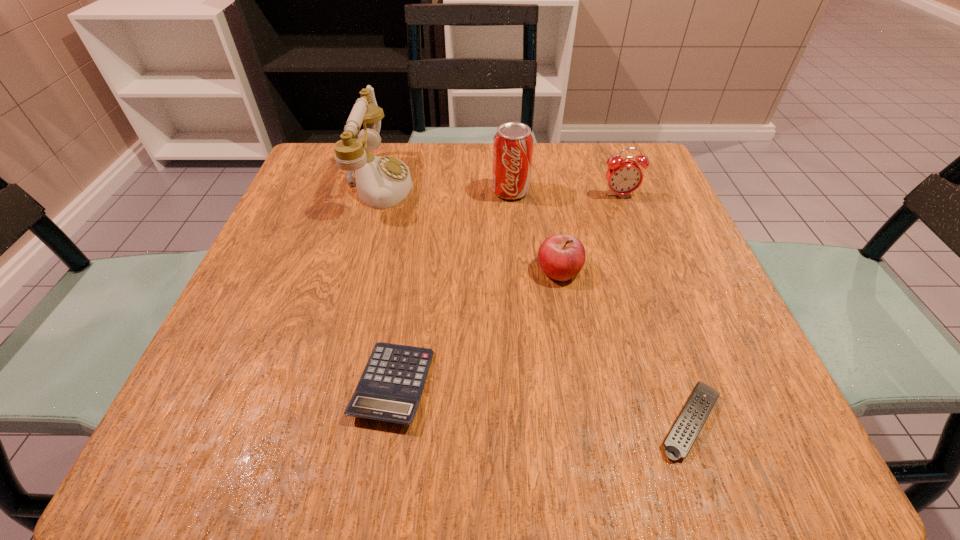
Locate an element on the screen. This screenshot has height=540, width=960. vacant space situated on the right of the third nearest object is located at coordinates (693, 270).

Identify the location of vacant space located on the back of the calculator. (416, 238).

In order to click on free spot located 0.320m on the back of the shortest object in this screenshot , I will do [x=627, y=238].

Find the location of a particular element. telephone at the far edge is located at coordinates (382, 182).

Find the location of a particular element. Image resolution: width=960 pixels, height=540 pixels. soda can present at the far edge is located at coordinates (513, 143).

Locate an element on the screen. Image resolution: width=960 pixels, height=540 pixels. alarm clock present at the far edge is located at coordinates (624, 176).

Where is `calculator present at the near edge`? The width and height of the screenshot is (960, 540). calculator present at the near edge is located at coordinates (390, 389).

This screenshot has width=960, height=540. In order to click on remote control located at the near edge in this screenshot , I will do `click(680, 439)`.

What are the coordinates of `object at the left edge` in the screenshot? It's located at (382, 182).

Identify the location of alarm clock located at the right edge. The height and width of the screenshot is (540, 960). (624, 176).